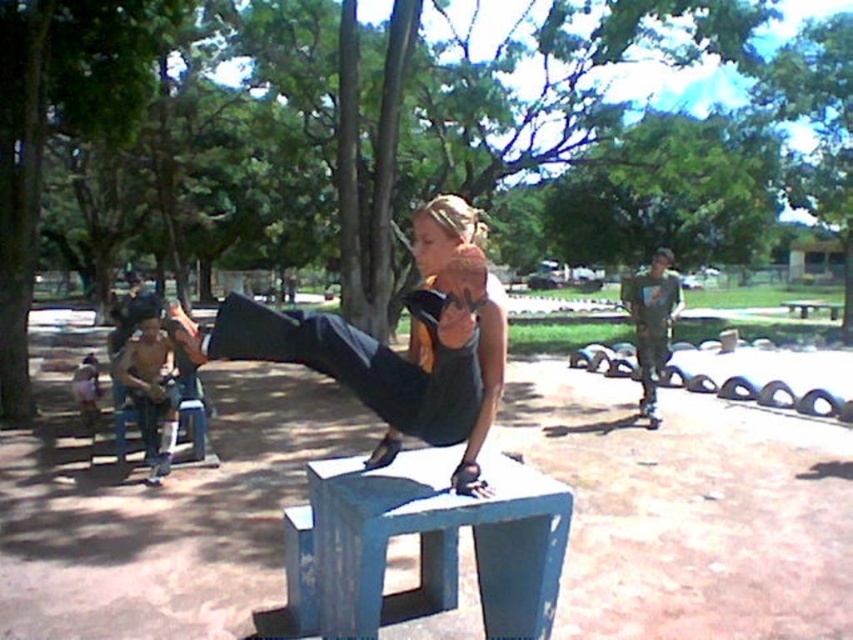
Who is shorter, blue painted concrete bench at center or wooden park bench at center?

blue painted concrete bench at center

Can you confirm if blue painted concrete bench at center is positioned above wooden park bench at center?

No.

Is point (440, 520) positioned behind point (833, 310)?

No, (440, 520) is closer to viewer.

Image resolution: width=853 pixels, height=640 pixels. In order to click on blue painted concrete bench at center in this screenshot , I will do `click(422, 545)`.

Is point (448, 557) positioned in front of point (428, 310)?

No, (448, 557) is further to viewer.

Can you confirm if blue painted concrete bench at center is shorter than matte black pants at center?

Correct, blue painted concrete bench at center is not as tall as matte black pants at center.

The width and height of the screenshot is (853, 640). What do you see at coordinates (422, 545) in the screenshot?
I see `blue painted concrete bench at center` at bounding box center [422, 545].

Find the location of a particular element. The height and width of the screenshot is (640, 853). blue painted concrete bench at center is located at coordinates (422, 545).

Who is higher up, blue painted concrete bench at center or shiny metallic helmet at left?

shiny metallic helmet at left is higher up.

The height and width of the screenshot is (640, 853). Find the location of `blue painted concrete bench at center`. blue painted concrete bench at center is located at coordinates (422, 545).